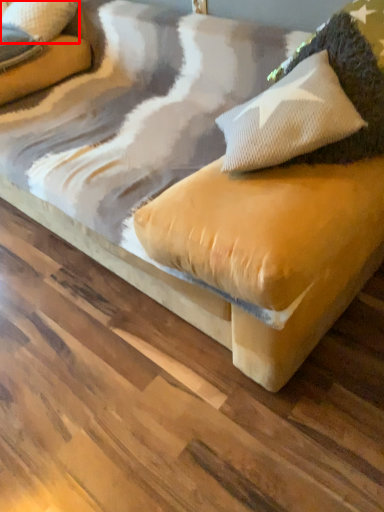
Question: From the image's perspective, what is the correct spatial positioning of pillow (annotated by the red box) in reference to pillow?

Choices:
 (A) below
 (B) above

Answer: (B)